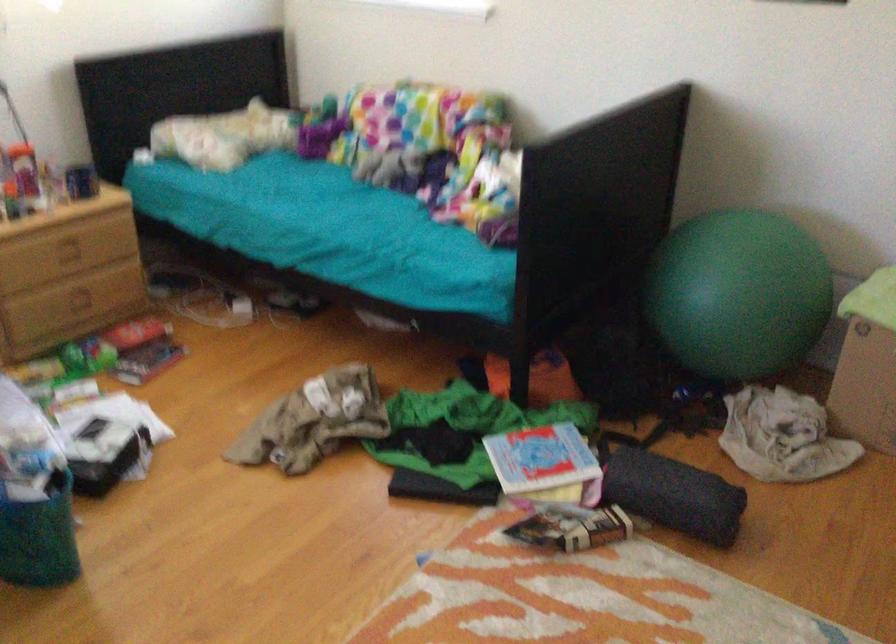
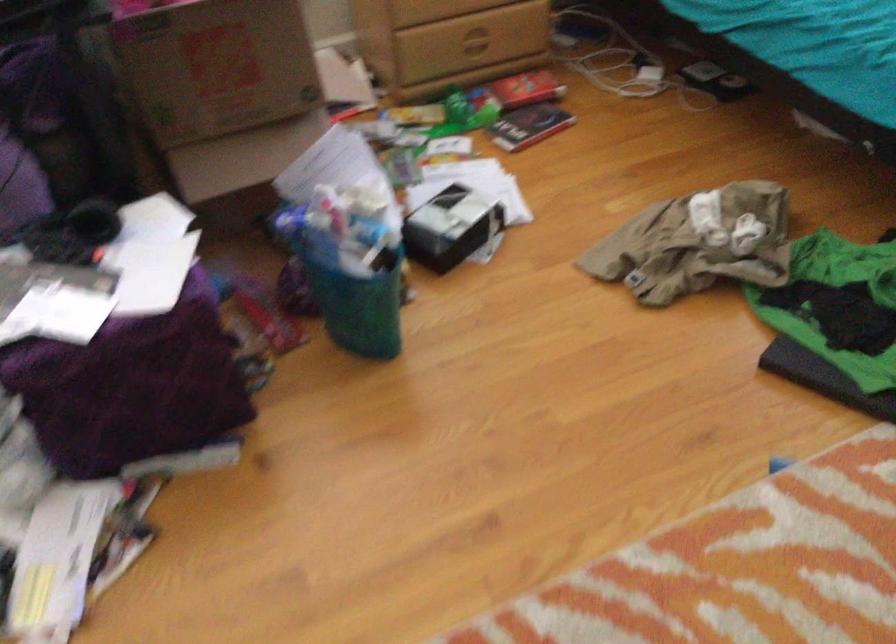
The point at (99, 448) is marked in the first image. Where is the corresponding point in the second image?

(451, 227)